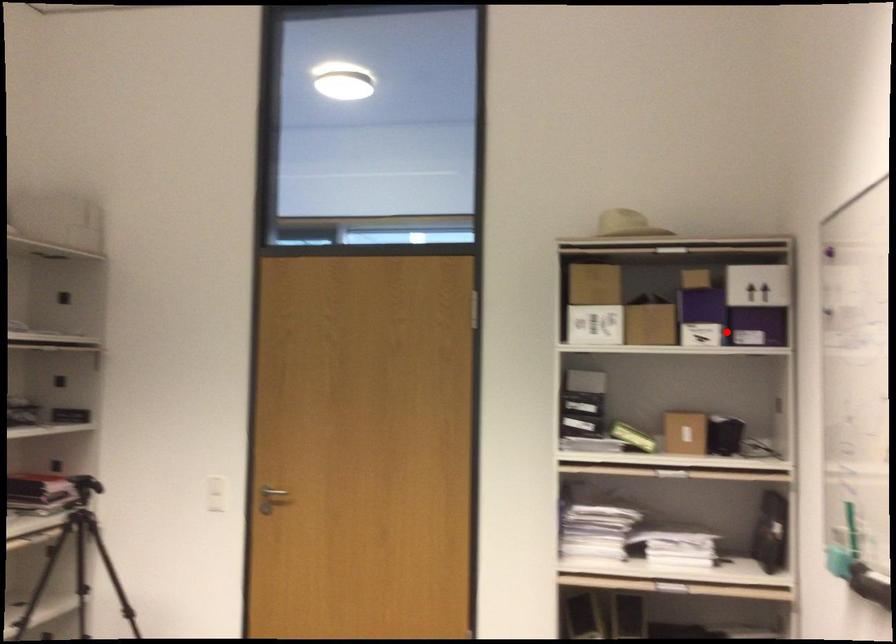
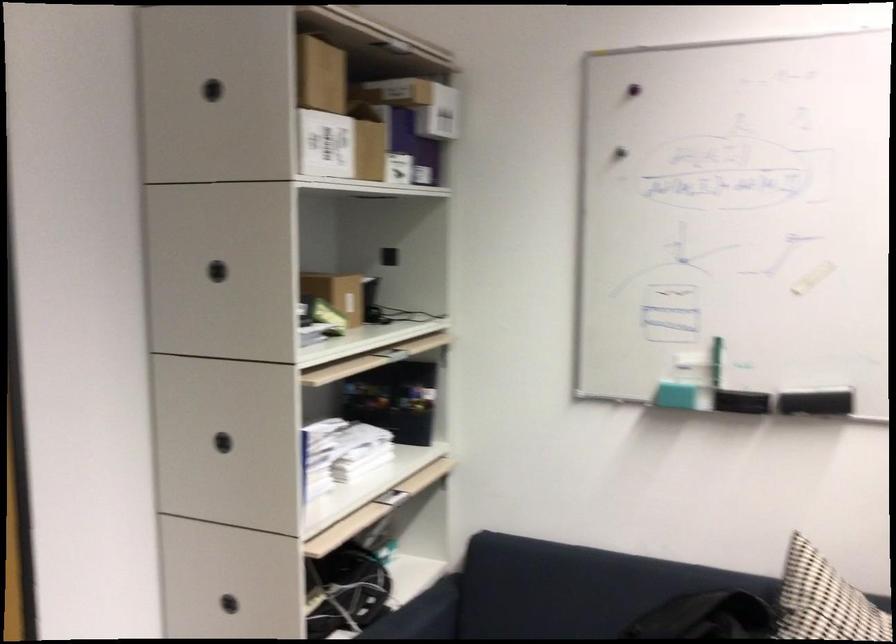
In the second image, find the point that corresponds to the highlighted location in the first image.

(398, 167)